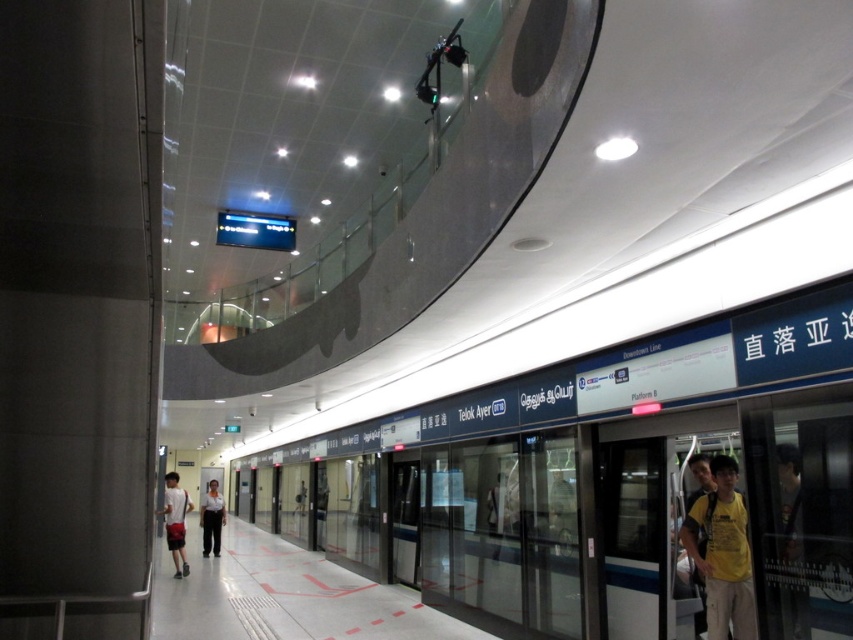
You are a passenger on the platform at Telok Ayer station. You want to reach a specific point marked at coordinates point (177, 566). If your walking speed is 3 feet per second, how many seconds will it take you to reach that point from your current position?

The point (177, 566) is 37.52 feet away from the camera. At a walking speed of 3 feet per second, it would take approximately 12.5 seconds to reach the point.